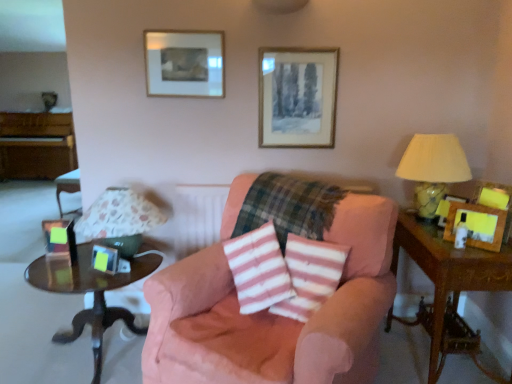
Locate an element on the screen. The image size is (512, 384). free space that is to the left of metallic silver picture frame at lower left, which ranks as the 2th picture frame in front-to-back order is located at coordinates (76, 273).